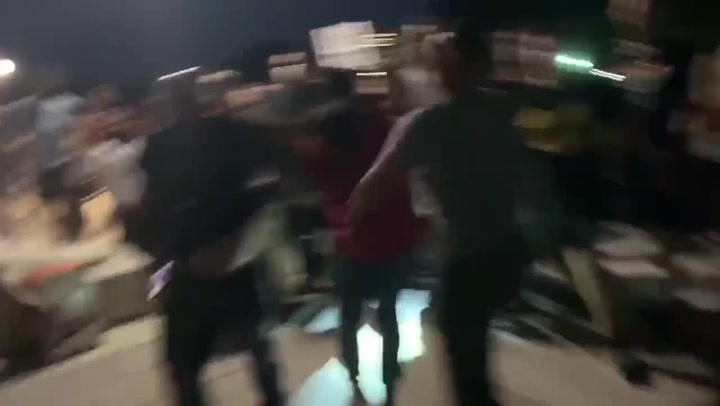
Identify the location of wall. The height and width of the screenshot is (406, 720). (114, 45).